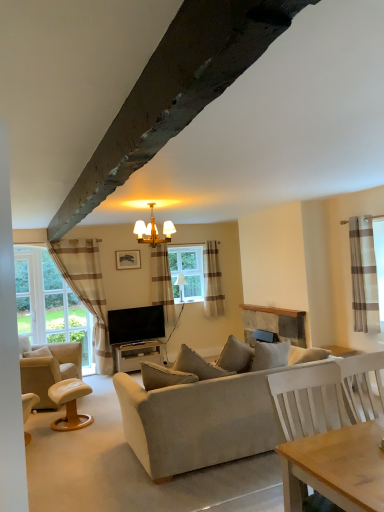
Question: Would you say beige striped curtain at left is part of light brown leather stool at lower left's contents?

Choices:
 (A) yes
 (B) no

Answer: (B)

Question: Is light brown leather stool at lower left located outside beige striped curtain at left?

Choices:
 (A) yes
 (B) no

Answer: (A)

Question: Is light brown leather stool at lower left thinner than beige striped curtain at left?

Choices:
 (A) no
 (B) yes

Answer: (A)

Question: From a real-world perspective, is light brown leather stool at lower left physically above beige striped curtain at left?

Choices:
 (A) no
 (B) yes

Answer: (A)

Question: Are light brown leather stool at lower left and beige striped curtain at left making contact?

Choices:
 (A) yes
 (B) no

Answer: (B)

Question: Is beige fabric couch at center in front of or behind matte gray table at center in the image?

Choices:
 (A) front
 (B) behind

Answer: (A)

Question: From a real-world perspective, is beige fabric couch at center positioned above or below matte gray table at center?

Choices:
 (A) below
 (B) above

Answer: (B)

Question: Is beige fabric couch at center spatially inside matte gray table at center, or outside of it?

Choices:
 (A) outside
 (B) inside

Answer: (A)

Question: Is beige fabric couch at center to the left or to the right of matte gray table at center in the image?

Choices:
 (A) right
 (B) left

Answer: (A)

Question: From the image's perspective, is beige fabric couch at center located above or below brown striped fabric curtain at right, positioned as the 1th curtain in right-to-left order?

Choices:
 (A) below
 (B) above

Answer: (A)

Question: Relative to brown striped fabric curtain at right, arranged as the fourth curtain when viewed from the back, is beige fabric couch at center in front or behind?

Choices:
 (A) behind
 (B) front

Answer: (B)

Question: Looking at their shapes, would you say beige fabric couch at center is wider or thinner than brown striped fabric curtain at right, arranged as the fourth curtain when viewed from the back?

Choices:
 (A) thin
 (B) wide

Answer: (B)

Question: In terms of size, does beige fabric couch at center appear bigger or smaller than brown striped fabric curtain at right, arranged as the fourth curtain when viewed from the back?

Choices:
 (A) big
 (B) small

Answer: (A)

Question: In terms of size, does beige fabric couch at center appear bigger or smaller than wooden picture frame at upper center?

Choices:
 (A) big
 (B) small

Answer: (A)

Question: Which is correct: beige fabric couch at center is inside wooden picture frame at upper center, or outside of it?

Choices:
 (A) outside
 (B) inside

Answer: (A)